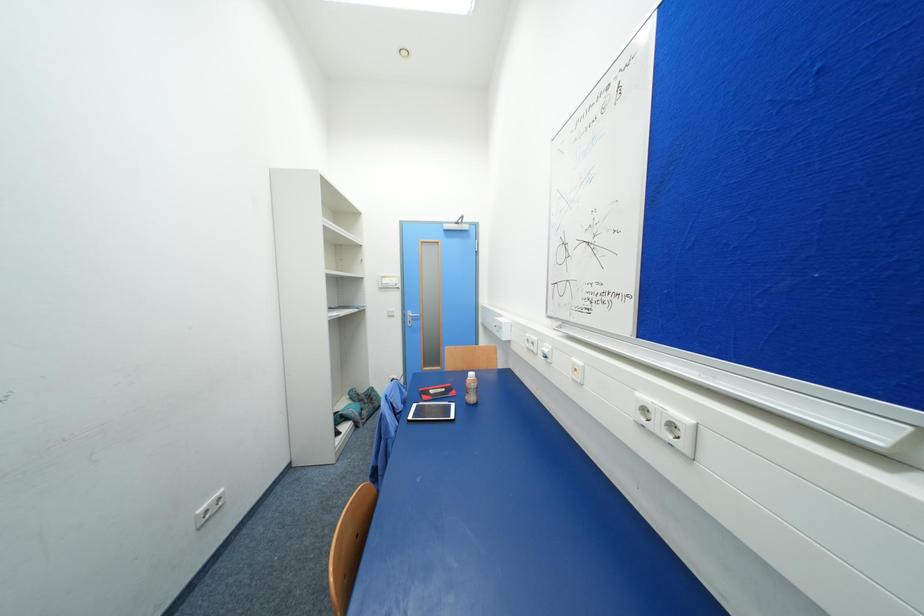
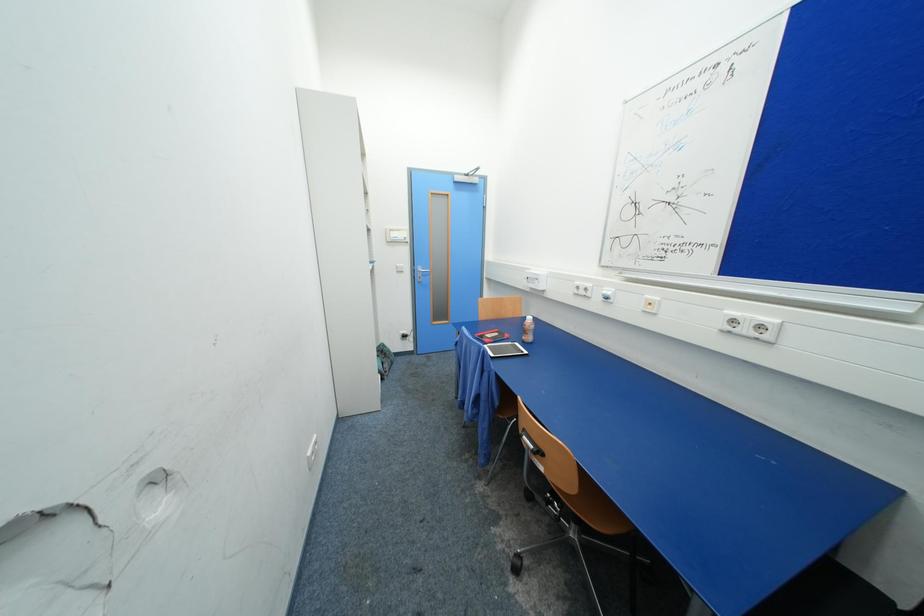
Question: Which direction would the cameraman need to move to produce the second image? Reply with the corresponding letter.

Choices:
 (A) Left
 (B) Right
 (C) Forward
 (D) Backward

Answer: (A)